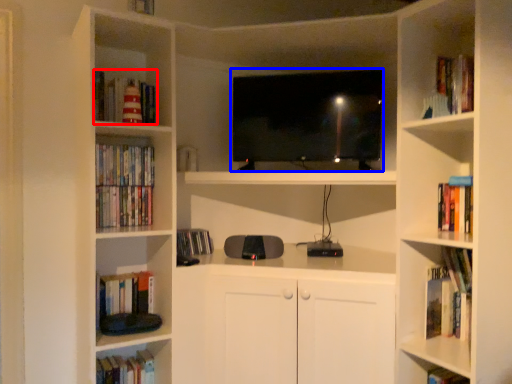
Question: Which point is further to the camera, book (highlighted by a red box) or television (highlighted by a blue box)?

Choices:
 (A) book
 (B) television

Answer: (B)